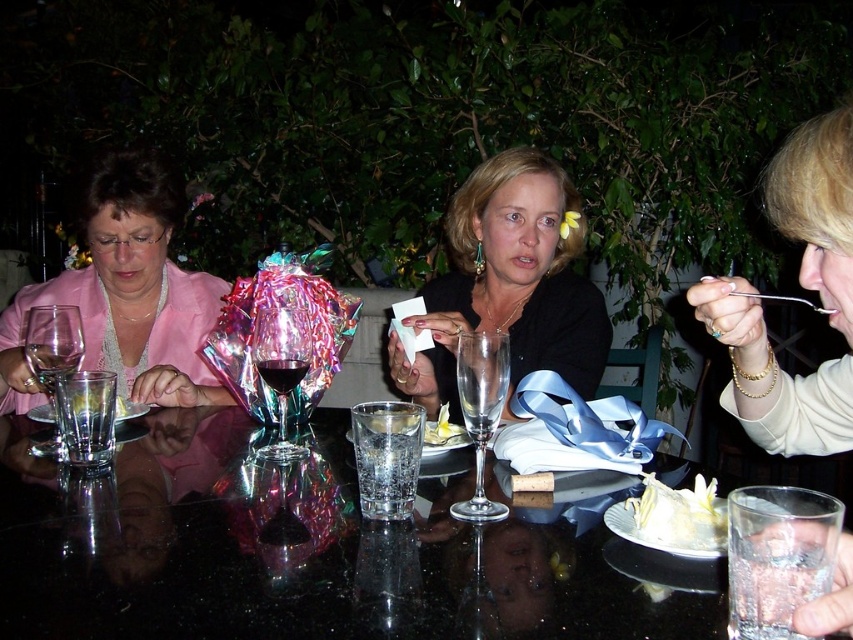
You are at the table and want to grab a drink. Which object is on the left side between the transparent glass at center and the clear glass water at table center?

The clear glass water at table center is on the left side because the transparent glass at center is to its right.

You are organizing a small event and need to place a new decorative item on the table. The item is the size of the transparent glass at center. Based on the scene, where could you place it without overcrowding the table, considering the existing items and the size of the matte pink jacket at left?

Since the matte pink jacket at left is larger than the transparent glass at center, you could place the new decorative item near the transparent glass at center, as there is more space available in that area compared to the space occupied by the larger matte pink jacket at left.